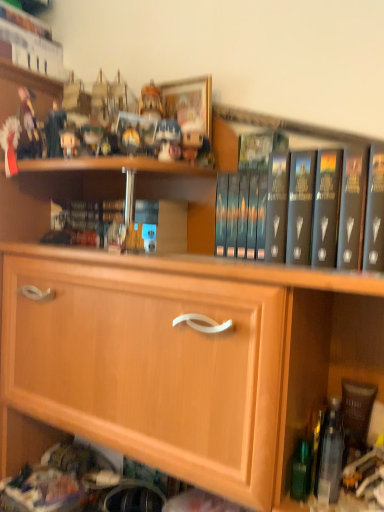
Describe the element at coordinates (337, 205) in the screenshot. I see `dark gray hardcover book at center, the 3th book in the left-to-right sequence` at that location.

Describe the element at coordinates (30, 127) in the screenshot. I see `matte plastic figurine at upper left, acting as the 1th toy starting from the back` at that location.

Locate an element on the screen. The height and width of the screenshot is (512, 384). dark gray hardcover book at center, which ranks as the first book in right-to-left order is located at coordinates (337, 205).

Does clear plastic bottle at lower right turn towards matte plastic toy at upper center, the second toy positioned from the back?

No, clear plastic bottle at lower right is not turned towards matte plastic toy at upper center, the second toy positioned from the back.

Between clear plastic bottle at lower right and matte plastic toy at upper center, the second toy positioned from the back, which one appears on the left side from the viewer's perspective?

matte plastic toy at upper center, the second toy positioned from the back.

Can you confirm if clear plastic bottle at lower right is shorter than matte plastic toy at upper center, positioned as the 2th toy in left-to-right order?

No.

Consider the image. From the image's perspective, which object appears higher, clear plastic bottle at lower right or matte plastic toy at upper center, which appears as the first toy when viewed from the right?

matte plastic toy at upper center, which appears as the first toy when viewed from the right, is shown above in the image.

Can you confirm if hardcover book at upper left, which is the 3th book in front-to-back order, is positioned to the right of dark gray hardcover book at center, the second book when ordered from bottom to top?

No, hardcover book at upper left, which is the 3th book in front-to-back order, is not to the right of dark gray hardcover book at center, the second book when ordered from bottom to top.

Between point (56, 73) and point (345, 165), which one is positioned behind?

The point (56, 73) is farther.

From a real-world perspective, is hardcover book at upper left, the 1th book viewed from the back, physically located above or below dark gray hardcover book at center, the second book from the top?

Clearly, from a real-world perspective, hardcover book at upper left, the 1th book viewed from the back, is above dark gray hardcover book at center, the second book from the top.

From the image's perspective, is hardcover book at upper left, which is the 3th book in front-to-back order, positioned above or below dark gray hardcover book at center, marked as the third book in a back-to-front arrangement?

Result: Clearly, from the image's perspective, hardcover book at upper left, which is the 3th book in front-to-back order, is above dark gray hardcover book at center, marked as the third book in a back-to-front arrangement.

Would you say dark gray hardcover book at center, marked as the third book in a back-to-front arrangement, is inside or outside wooden cabinet at center?

dark gray hardcover book at center, marked as the third book in a back-to-front arrangement, can be found inside wooden cabinet at center.

Who is shorter, dark gray hardcover book at center, the 3th book in the left-to-right sequence, or wooden cabinet at center?

dark gray hardcover book at center, the 3th book in the left-to-right sequence, is shorter.

Is dark gray hardcover book at center, the second book when ordered from bottom to top, positioned far away from wooden cabinet at center?

No, dark gray hardcover book at center, the second book when ordered from bottom to top, is not far away from wooden cabinet at center.

From the image's perspective, which one is positioned lower, dark gray hardcover book at center, the 3th book in the left-to-right sequence, or wooden cabinet at center?

wooden cabinet at center.

The image size is (384, 512). I want to click on bottle on the right of wooden cabinet at center, so click(x=330, y=454).

Would you say clear plastic bottle at lower right contains wooden cabinet at center?

That's incorrect, wooden cabinet at center is not inside clear plastic bottle at lower right.

Considering the positions of point (319, 485) and point (273, 387), is point (319, 485) closer or farther from the camera than point (273, 387)?

Point (319, 485) is farther from the camera than point (273, 387).

From the image's perspective, which object appears higher, clear plastic bottle at lower right or wooden cabinet at center?

wooden cabinet at center is shown above in the image.

Is hardcover book at center, arranged as the second book when viewed from the right, turned away from clear plastic bottle at lower right?

No, hardcover book at center, arranged as the second book when viewed from the right, is not facing the opposite direction of clear plastic bottle at lower right.

From the picture: Is hardcover book at center, the third book from the top, taller or shorter than clear plastic bottle at lower right?

Clearly, hardcover book at center, the third book from the top, is shorter compared to clear plastic bottle at lower right.

Which object is positioned more to the left, hardcover book at center, which ranks as the first book in bottom-to-top order, or clear plastic bottle at lower right?

From the viewer's perspective, hardcover book at center, which ranks as the first book in bottom-to-top order, appears more on the left side.

From the picture: Is the position of hardcover book at center, arranged as the second book when viewed from the right, more distant than that of clear plastic bottle at lower right?

Yes, it is behind clear plastic bottle at lower right.

Looking at this image, does dark gray hardcover book at center, which ranks as the first book in right-to-left order, have a larger size compared to hardcover book at upper left, the 1th book viewed from the back?

Actually, dark gray hardcover book at center, which ranks as the first book in right-to-left order, might be smaller than hardcover book at upper left, the 1th book viewed from the back.

Is hardcover book at upper left, which appears as the 1th book when viewed from the top, completely or partially inside dark gray hardcover book at center, which ranks as the first book in right-to-left order?

No, hardcover book at upper left, which appears as the 1th book when viewed from the top, is not a part of dark gray hardcover book at center, which ranks as the first book in right-to-left order.

Is dark gray hardcover book at center, the 1th book when ordered from front to back, to the right of hardcover book at upper left, which is the 3th book in front-to-back order, from the viewer's perspective?

Yes.

Which is behind, point (246, 234) or point (50, 69)?

Point (50, 69)

From the image's perspective, relative to matte plastic toy at upper center, positioned as the 2th toy in left-to-right order, is dark gray hardcover book at center, the 1th book when ordered from front to back, above or below?

Based on their image positions, dark gray hardcover book at center, the 1th book when ordered from front to back, is located beneath matte plastic toy at upper center, positioned as the 2th toy in left-to-right order.

Is dark gray hardcover book at center, the second book when ordered from bottom to top, closer to the viewer compared to matte plastic toy at upper center, the second toy positioned from the back?

Yes, the depth of dark gray hardcover book at center, the second book when ordered from bottom to top, is less than that of matte plastic toy at upper center, the second toy positioned from the back.

Which of these two, dark gray hardcover book at center, which ranks as the first book in right-to-left order, or matte plastic toy at upper center, positioned as the 2th toy in left-to-right order, is wider?

dark gray hardcover book at center, which ranks as the first book in right-to-left order, is wider.

Is dark gray hardcover book at center, the second book when ordered from bottom to top, located outside matte plastic toy at upper center, the second toy positioned from the back?

Absolutely, dark gray hardcover book at center, the second book when ordered from bottom to top, is external to matte plastic toy at upper center, the second toy positioned from the back.

The image size is (384, 512). I want to click on the 1st toy directly above the clear plastic bottle at lower right (from a real-world perspective), so click(x=168, y=139).

From a real-world perspective, starting from the hardcover book at upper left, the 3th book from the right, which book is the 1st one below it? Please provide its 2D coordinates.

[(337, 205)]

From the image, which object appears to be farther from wooden cabinet at center, matte plastic figurine at upper left, acting as the 1th toy starting from the back, or clear plastic bottle at lower right?

matte plastic figurine at upper left, acting as the 1th toy starting from the back, lies further to wooden cabinet at center than the other object.

Consider the image. Based on their spatial positions, is hardcover book at center, the 2th book viewed from the back, or matte plastic toy at upper center, the second toy positioned from the back, further from clear plastic bottle at lower right?

The object further to clear plastic bottle at lower right is hardcover book at center, the 2th book viewed from the back.

From the image, which object appears to be nearer to hardcover book at center, placed as the 2th book when sorted from left to right, clear plastic bottle at lower right or dark gray hardcover book at center, the 3th book in the left-to-right sequence?

dark gray hardcover book at center, the 3th book in the left-to-right sequence, is closer to hardcover book at center, placed as the 2th book when sorted from left to right.

Based on the photo, from the image, which object appears to be farther from matte plastic figurine at upper left, acting as the 1th toy starting from the back, wooden cabinet at center or clear plastic bottle at lower right?

clear plastic bottle at lower right.

From the image, which object appears to be farther from hardcover book at center, arranged as the second book when viewed from the right, matte plastic toy at upper center, positioned as the 1th toy in front-to-back order, or dark gray hardcover book at center, the 3th book in the left-to-right sequence?

Among the two, dark gray hardcover book at center, the 3th book in the left-to-right sequence, is located further to hardcover book at center, arranged as the second book when viewed from the right.

Looking at the image, which one is located closer to dark gray hardcover book at center, marked as the third book in a back-to-front arrangement, wooden cabinet at center or hardcover book at center, the 2th book viewed from the front?

wooden cabinet at center is positioned closer to the anchor dark gray hardcover book at center, marked as the third book in a back-to-front arrangement.

Based on their spatial positions, is hardcover book at center, which ranks as the first book in bottom-to-top order, or matte plastic figurine at upper left, which ranks as the second toy in front-to-back order, closer to clear plastic bottle at lower right?

Among the two, hardcover book at center, which ranks as the first book in bottom-to-top order, is located nearer to clear plastic bottle at lower right.

Based on their spatial positions, is wooden cabinet at center or hardcover book at upper left, the 1th book viewed from the back, closer to matte plastic figurine at upper left, which ranks as the second toy in front-to-back order?

hardcover book at upper left, the 1th book viewed from the back, is closer to matte plastic figurine at upper left, which ranks as the second toy in front-to-back order.

Where is `book between dark gray hardcover book at center, the 1th book when ordered from front to back, and clear plastic bottle at lower right vertically`? book between dark gray hardcover book at center, the 1th book when ordered from front to back, and clear plastic bottle at lower right vertically is located at coordinates (104, 225).

Image resolution: width=384 pixels, height=512 pixels. In order to click on cabinetry between matte plastic toy at upper center, positioned as the 2th toy in left-to-right order, and clear plastic bottle at lower right, in the vertical direction in this screenshot , I will do (181, 361).

You are a GUI agent. You are given a task and a screenshot of the screen. Output one action in this format:
    pyautogui.click(x=<x>, y=<y>)
    Task: Click on the toy between matte plastic figurine at upper left, marked as the second toy in a right-to-left arrangement, and wooden cabinet at center vertically
    Image resolution: width=384 pixels, height=512 pixels.
    Given the screenshot: What is the action you would take?
    168,139

I want to click on book positioned between wooden cabinet at center and hardcover book at center, which ranks as the first book in bottom-to-top order, from near to far, so pos(337,205).